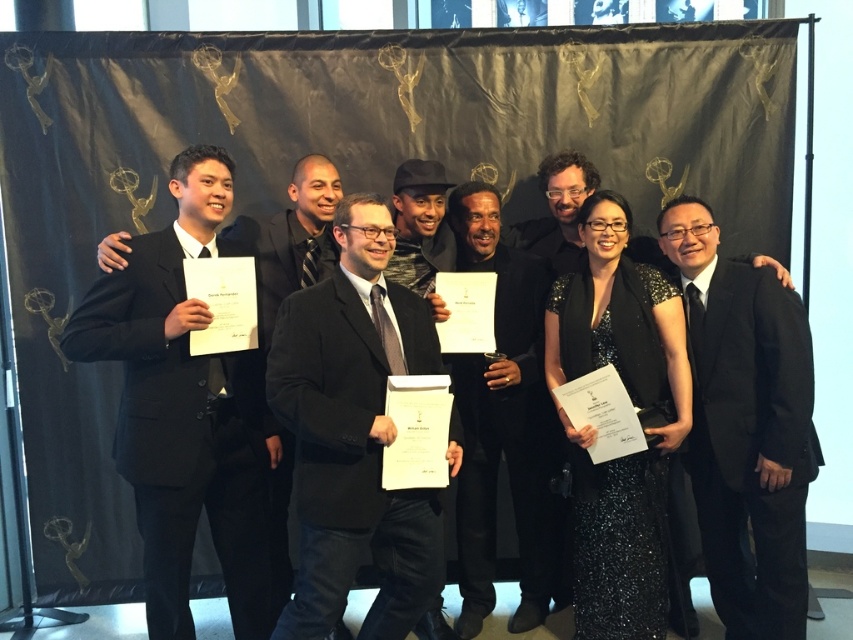
You are a photographer at the awards ceremony. You need to adjust the height of the podium for the next speaker who will stand between the black suit at right and the black velvet suit at center. Which podium height should you set based on their heights?

The black suit at right is shorter than the black velvet suit at center, so you should set the podium height to accommodate the taller individual, which is the black velvet suit at center.

You are a photographer at the awards ceremony. You need to adjust the lighting so that both the black suit at right and the black velvet suit at center are equally visible. Considering their sizes, which suit requires more light to achieve this?

The black suit at right is bigger than the black velvet suit at center, so it requires more light to ensure both are equally visible.

You are a photographer at the awards ceremony. You need to adjust the lighting so that both the black matte suit at left and the matte black suit at center are equally visible. Considering their sizes, which suit requires more light to achieve this?

The black matte suit at left is bigger than the matte black suit at center, so it requires more light to ensure both are equally visible.